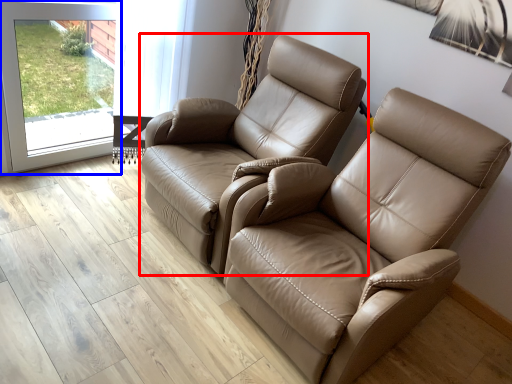
Question: Which of the following is the closest to the observer, chair (highlighted by a red box) or screen door (highlighted by a blue box)?

Choices:
 (A) chair
 (B) screen door

Answer: (A)